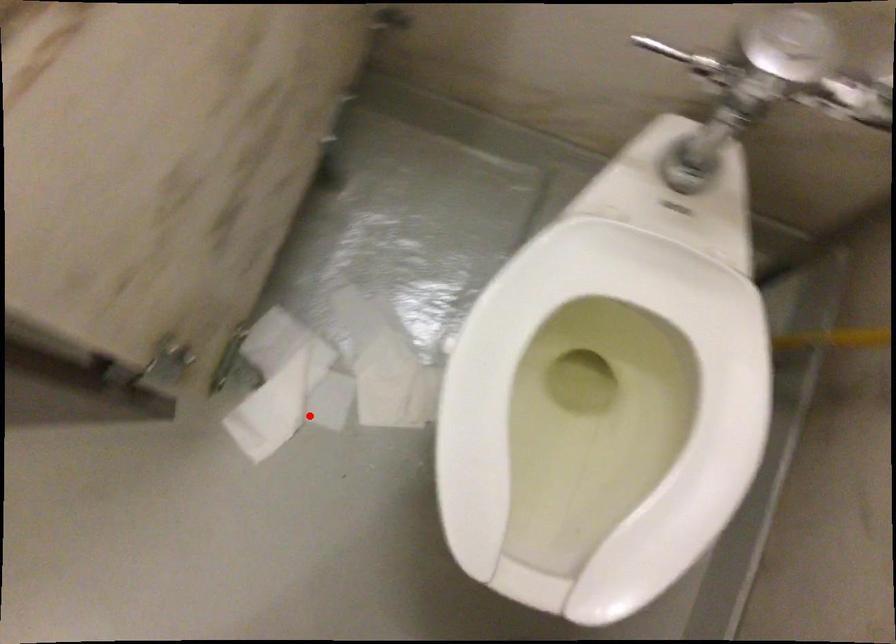
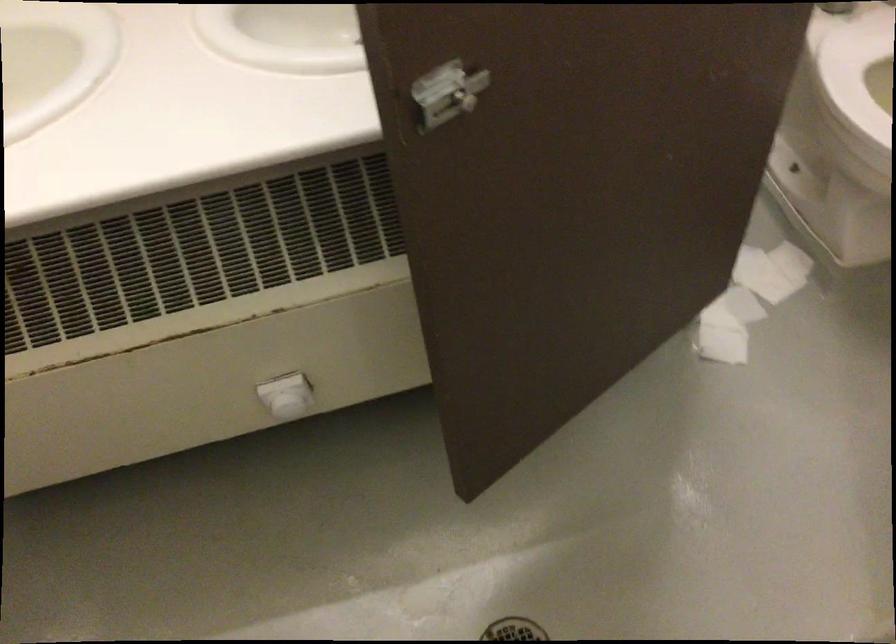
Where in the second image is the point corresponding to the highlighted location from the first image?

(739, 305)